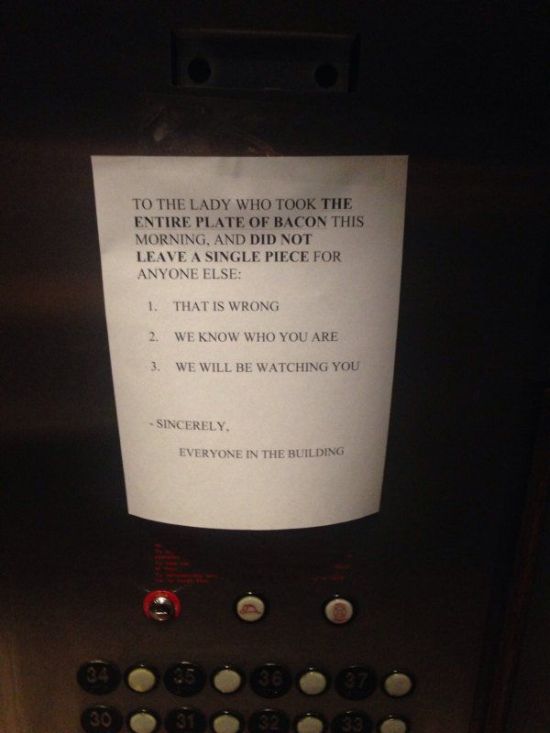
Locate an element on the screen. The height and width of the screenshot is (733, 550). elevator is located at coordinates (44, 578).